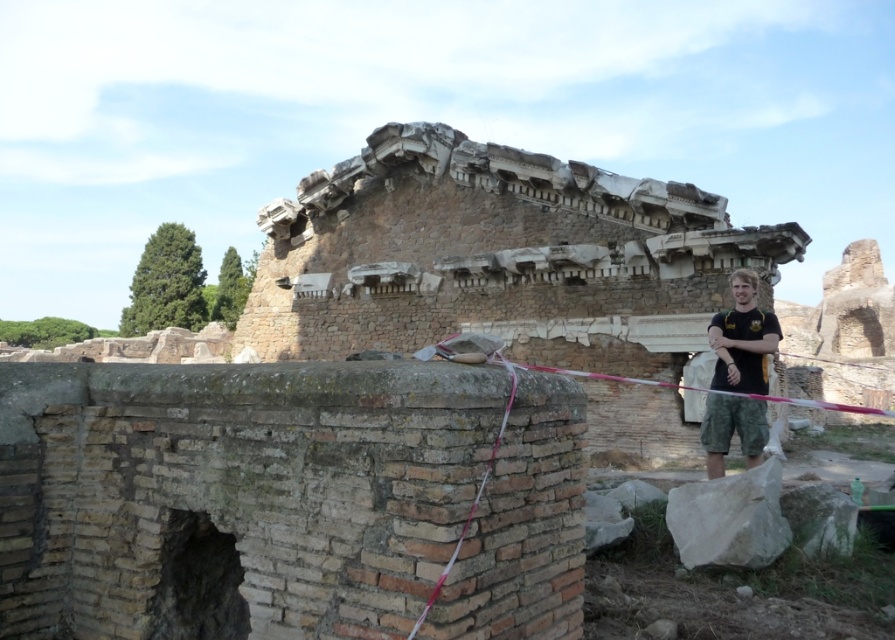
You are an archaeologist examining the site. You need to determine if the camouflage shorts at right can be used to secure the pink fabric rope at center. Based on their sizes, is this feasible?

The camouflage shorts at right has a smaller size compared to pink fabric rope at center, so it may not be sufficient to secure the pink fabric rope at center effectively.

You are an archaeologist examining the site. You notice the camouflage shorts at right and the pink fabric rope at center. Which object is positioned lower in the image?

The camouflage shorts at right is below the pink fabric rope at center, so it is positioned lower in the image.